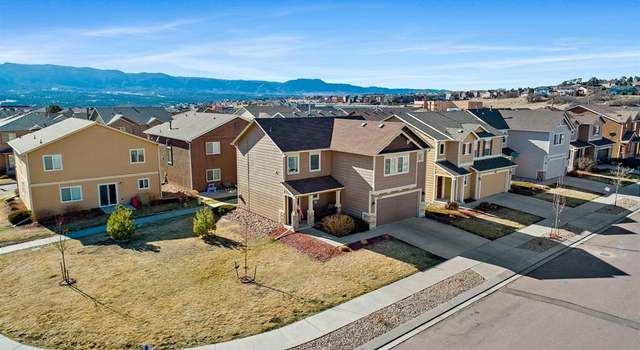
At what (x,y) coordinates should I click in order to perform the action: click on childs toy chair. Please return your answer as a coordinate pair (x, y). This screenshot has height=350, width=640. Looking at the image, I should click on (211, 188).